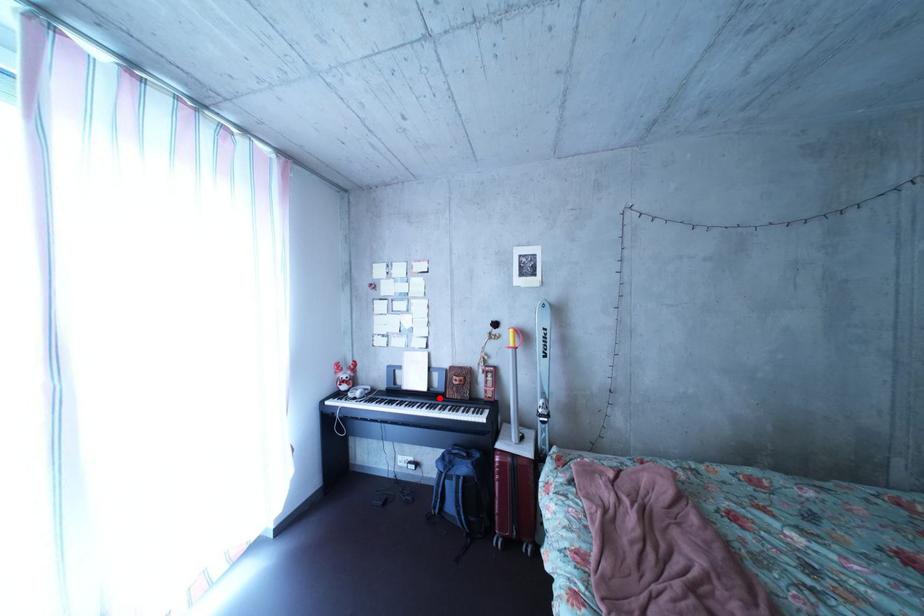
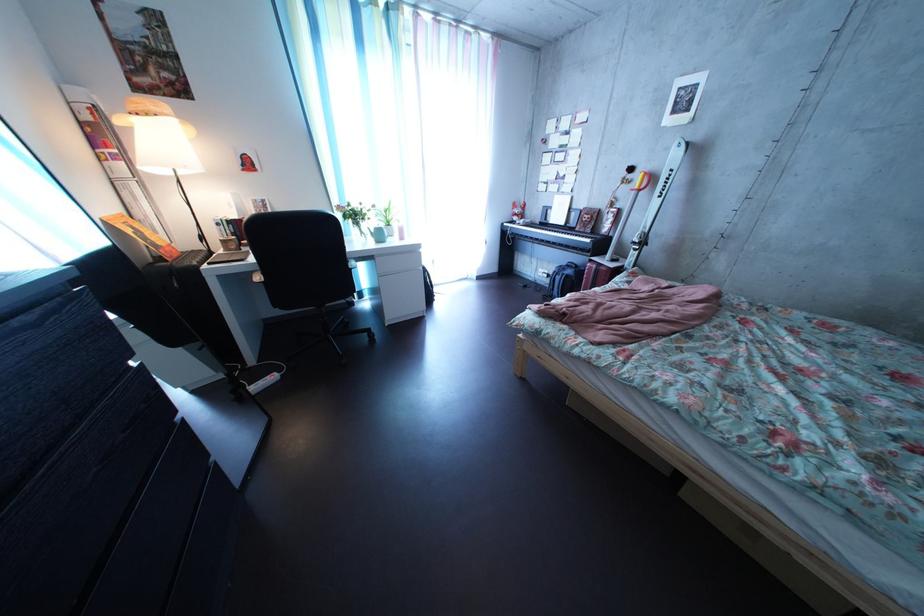
Where in the second image is the point corresponding to the highlighted location from the first image?

(577, 232)